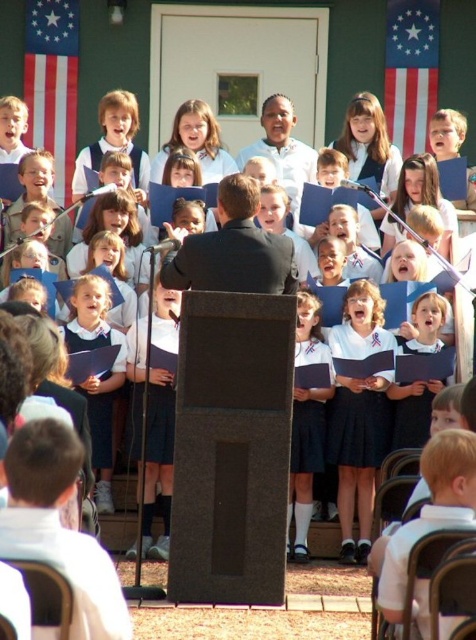
Does american flag at upper left appear under red fabric flag at upper right?

Indeed, american flag at upper left is positioned under red fabric flag at upper right.

I want to click on american flag at upper left, so [x=52, y=83].